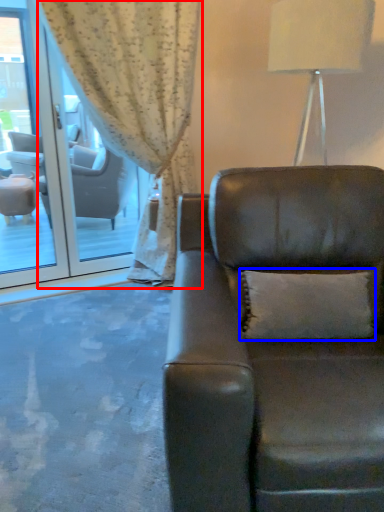
Question: Which object appears farthest to the camera in this image, curtain (highlighted by a red box) or pillow (highlighted by a blue box)?

Choices:
 (A) curtain
 (B) pillow

Answer: (A)